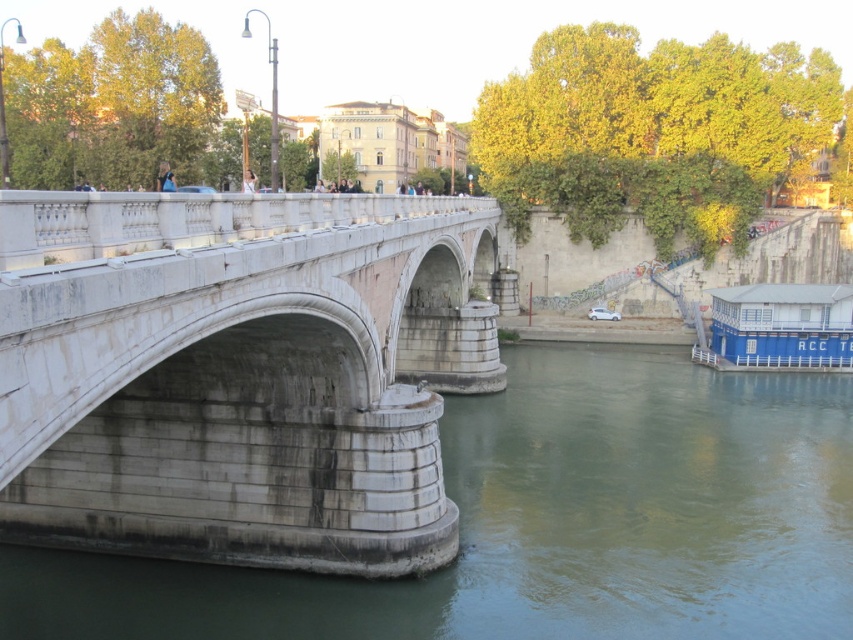
Question: Does white stone bridge at center have a smaller size compared to greenish concrete river at lower left?

Choices:
 (A) no
 (B) yes

Answer: (A)

Question: Is white stone bridge at center wider than greenish concrete river at lower left?

Choices:
 (A) yes
 (B) no

Answer: (B)

Question: Considering the relative positions of white stone bridge at center and greenish concrete river at lower left in the image provided, where is white stone bridge at center located with respect to greenish concrete river at lower left?

Choices:
 (A) above
 (B) below

Answer: (A)

Question: Among these points, which one is nearest to the camera?

Choices:
 (A) (39, 224)
 (B) (796, 545)

Answer: (A)

Question: Which of the following is the farthest from the observer?

Choices:
 (A) (277, 237)
 (B) (500, 520)

Answer: (B)